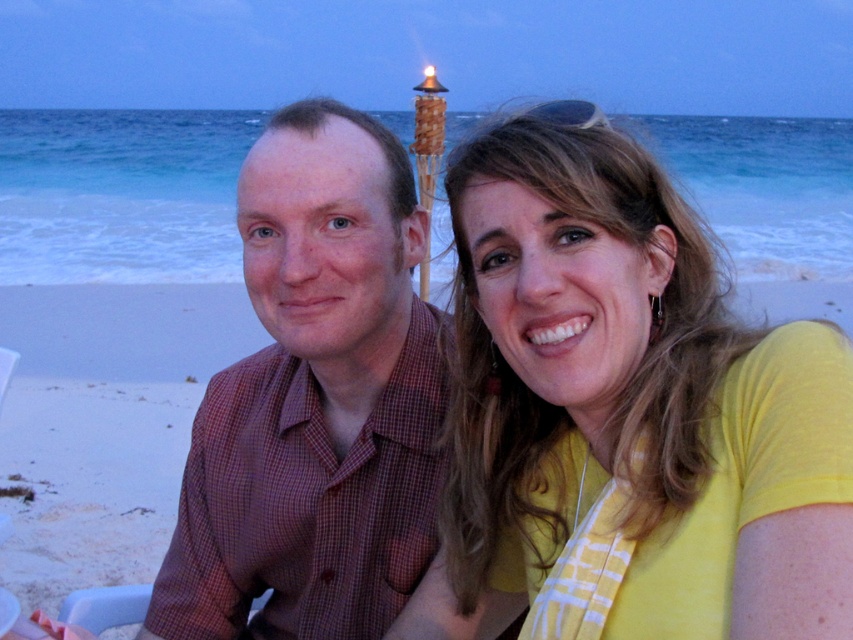
You are a photographer trying to capture the yellow fabric at upper right in the image. The camera you are using has a focus point at coordinates point (625, 413). Will the yellow fabric at upper right be in focus?

The yellow fabric at upper right is located at point (625, 413), so yes, the camera focus point is exactly at that coordinate, meaning the yellow fabric at upper right will be in focus.

You are standing on the beach looking at the scene. There are two points marked in the image. The first point is at coordinates point (849, 392) and the second is at point (289, 236). Which of these two points is closer to you?

Point (849, 392) is closer to the viewer than point (289, 236).

You are a photographer trying to capture both the yellow fabric at upper right and the plaid shirt at center in a single frame. Which object should you focus on first if you want to ensure both are in clear view?

The yellow fabric at upper right has a smaller size compared to plaid shirt at center, so you should focus on the plaid shirt at center first to ensure both are in clear view.